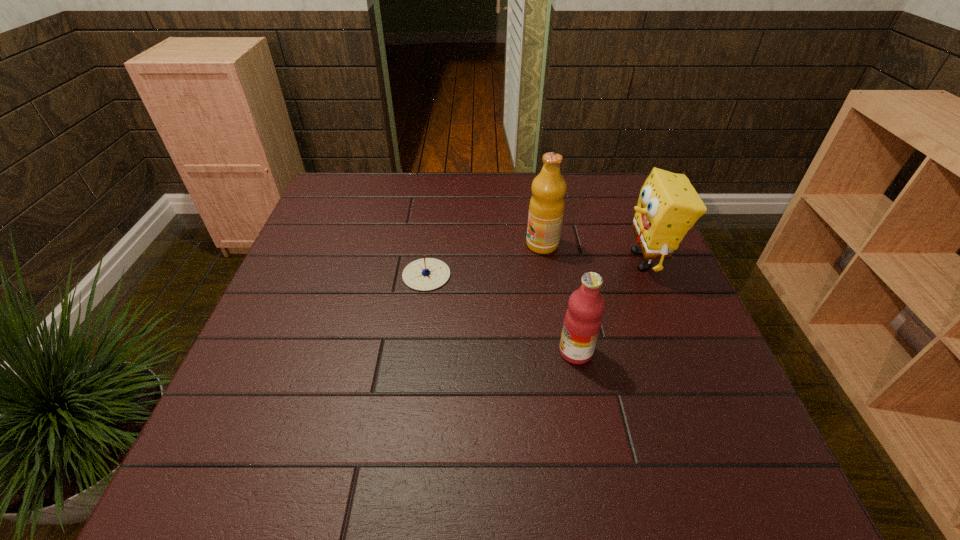
Find the location of a particular element. Image resolution: width=960 pixels, height=540 pixels. vacant space that is in between the compass and the rightmost object is located at coordinates (536, 268).

The image size is (960, 540). Identify the location of free space between the farther fruit juice and the shorter fruit juice. (559, 298).

Identify which object is the closest to the taller fruit juice. Please provide its 2D coordinates. Your answer should be formatted as a tuple, i.e. [(x, y)], where the tuple contains the x and y coordinates of a point satisfying the conditions above.

[(668, 206)]

At what (x,y) coordinates should I click in order to perform the action: click on object identified as the closest to the rightmost object. Please return your answer as a coordinate pair (x, y). Image resolution: width=960 pixels, height=540 pixels. Looking at the image, I should click on (546, 208).

Find the location of a particular element. This screenshot has height=540, width=960. blank space that satisfies the following two spatial constraints: 1. on the front label of the farther fruit juice; 2. on the front side of the compass is located at coordinates pyautogui.click(x=547, y=275).